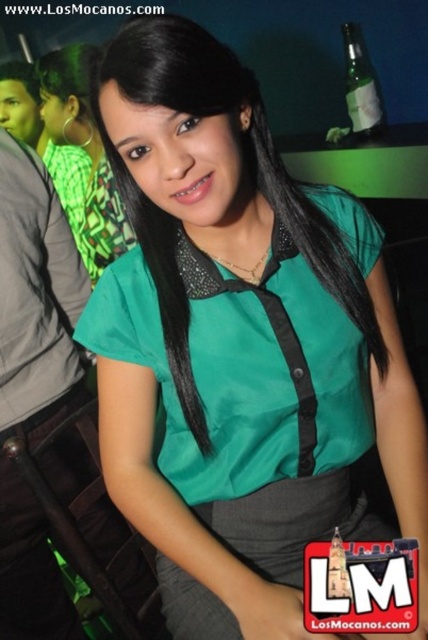
Which is above, green satin blouse at center or green glass bottle at upper right?

green glass bottle at upper right

Between green satin blouse at center and green glass bottle at upper right, which one appears on the left side from the viewer's perspective?

Positioned to the left is green satin blouse at center.

Measure the distance between point (x=88, y=241) and camera.

Point (x=88, y=241) and camera are 6.00 feet apart from each other.

Identify the location of green satin blouse at center. The image size is (428, 640). (85, 150).